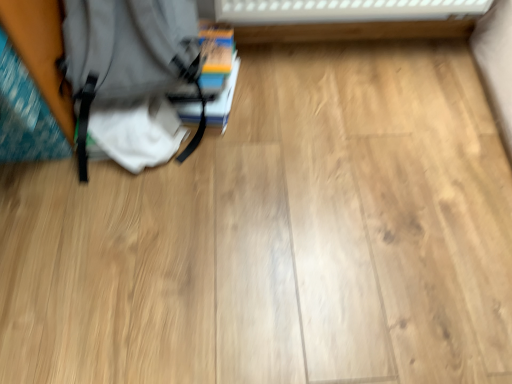
Question: Considering their positions, is matte gray backpack at left located in front of or behind hardcover book at center-left?

Choices:
 (A) behind
 (B) front

Answer: (B)

Question: From a real-world perspective, is matte gray backpack at left positioned above or below hardcover book at center-left?

Choices:
 (A) above
 (B) below

Answer: (A)

Question: In the image, is matte gray backpack at left on the left side or the right side of hardcover book at center-left?

Choices:
 (A) right
 (B) left

Answer: (B)

Question: From a real-world perspective, is hardcover book at center-left positioned above or below matte gray backpack at left?

Choices:
 (A) above
 (B) below

Answer: (B)

Question: Considering the positions of point (236, 79) and point (129, 54), is point (236, 79) closer or farther from the camera than point (129, 54)?

Choices:
 (A) closer
 (B) farther

Answer: (B)

Question: Looking at their shapes, would you say hardcover book at center-left is wider or thinner than matte gray backpack at left?

Choices:
 (A) thin
 (B) wide

Answer: (B)

Question: From the image's perspective, is hardcover book at center-left located above or below matte gray backpack at left?

Choices:
 (A) above
 (B) below

Answer: (A)